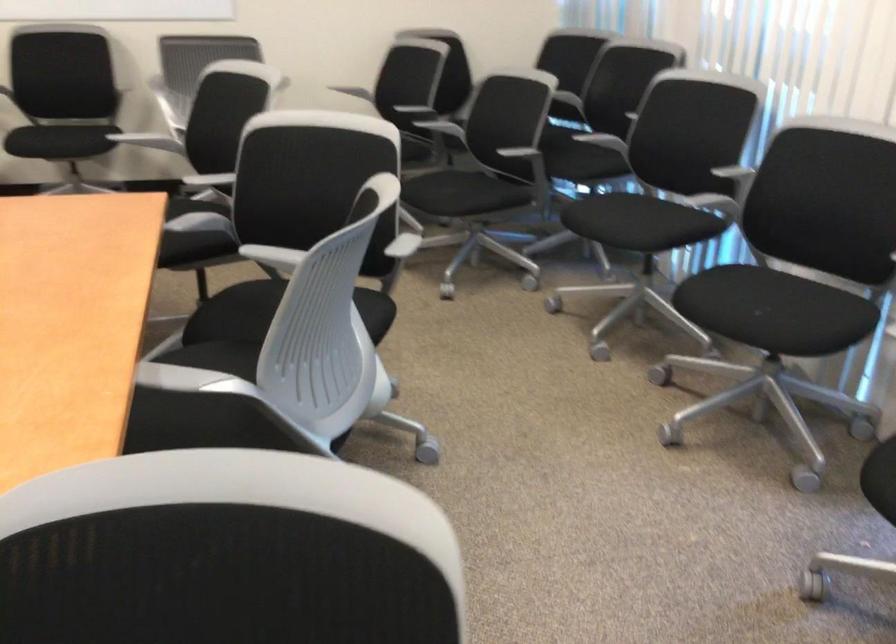
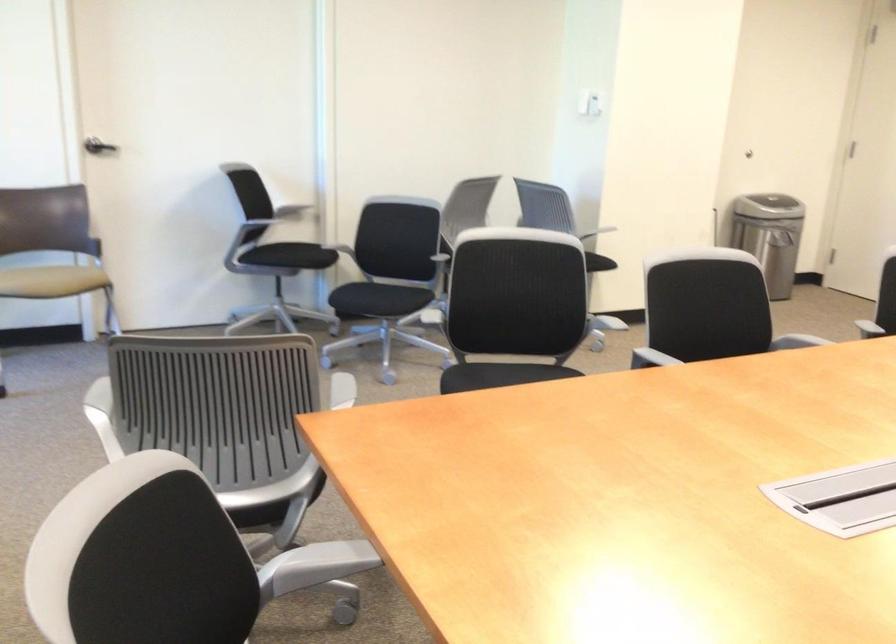
In the second image, find the point that corresponds to pixel 124 366 in the first image.

(320, 562)